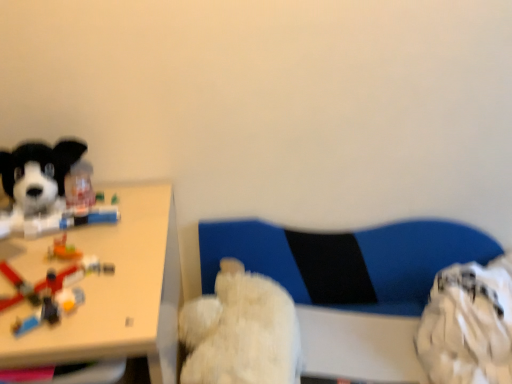
Question: In the image, is translucent plastic toy at left on the left side or the right side of soft plush dog at left, the 1th dog when ordered from left to right?

Choices:
 (A) right
 (B) left

Answer: (A)

Question: Is translucent plastic toy at left in front of or behind soft plush dog at left, which is counted as the 2th dog, starting from the bottom, in the image?

Choices:
 (A) behind
 (B) front

Answer: (B)

Question: Considering the real-world distances, which object is farthest from the soft plush dog at left, the 1th dog when ordered from left to right?

Choices:
 (A) fluffy white teddy bear at center, the 1th dog positioned from the bottom
 (B) blue fabric swivel chair at center
 (C) white plastic table at left
 (D) translucent plastic toy at left

Answer: (B)

Question: Based on their relative distances, which object is farther from the soft plush dog at left, the 1th dog when ordered from left to right?

Choices:
 (A) white plastic table at left
 (B) translucent plastic toy at left
 (C) blue fabric swivel chair at center
 (D) fluffy white teddy bear at center, which is counted as the second dog, starting from the top

Answer: (C)